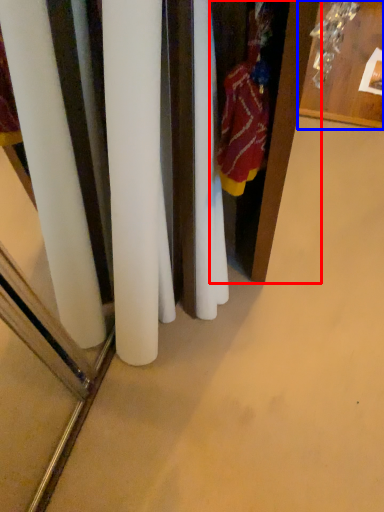
Question: Among these objects, which one is nearest to the camera, armoire (highlighted by a red box) or furniture (highlighted by a blue box)?

Choices:
 (A) armoire
 (B) furniture

Answer: (A)